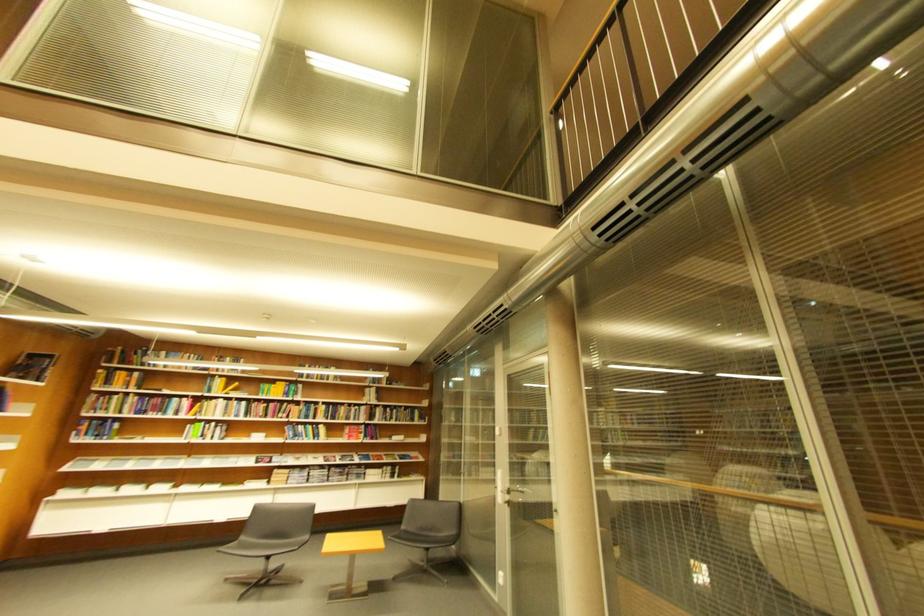
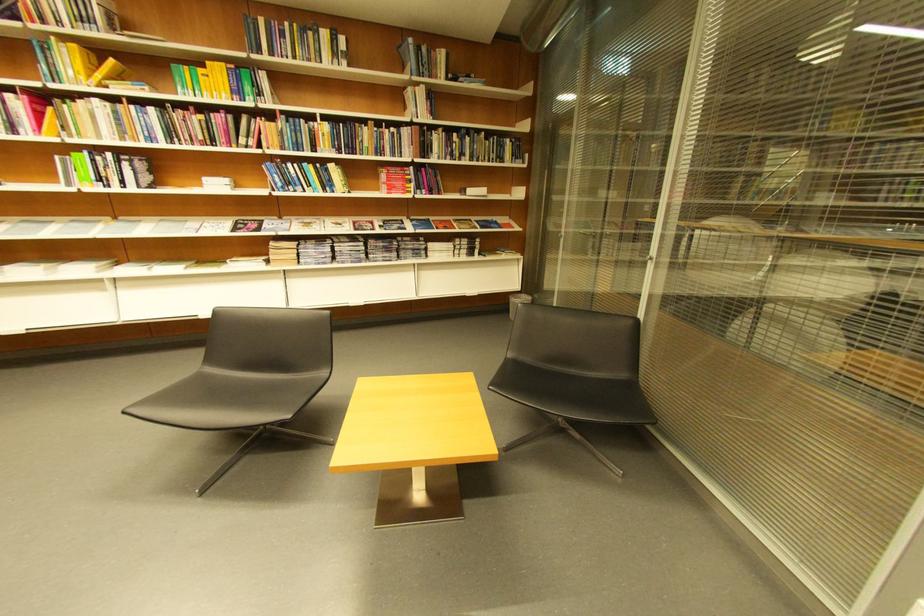
Find the pixel in the second image that matches (x=295, y=385) in the first image.

(234, 66)